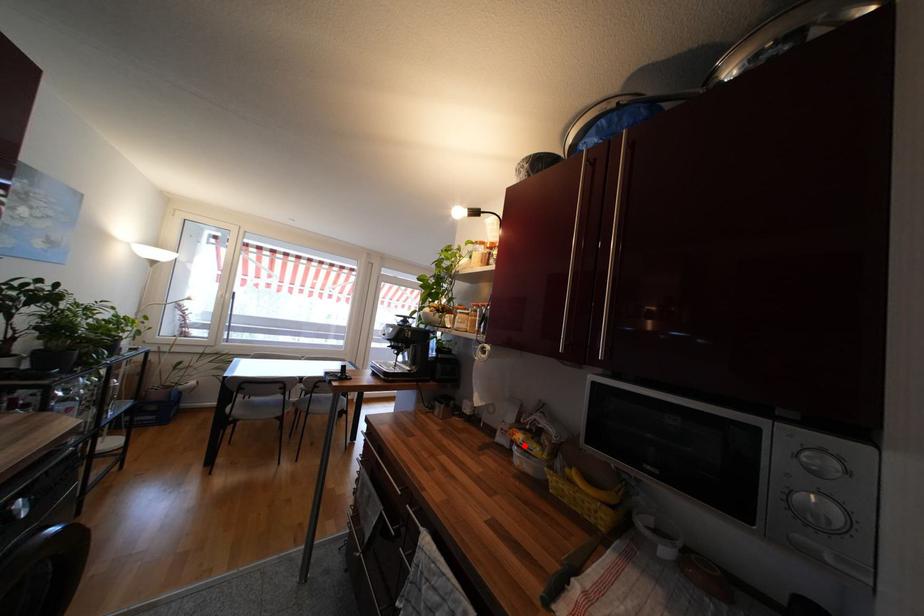
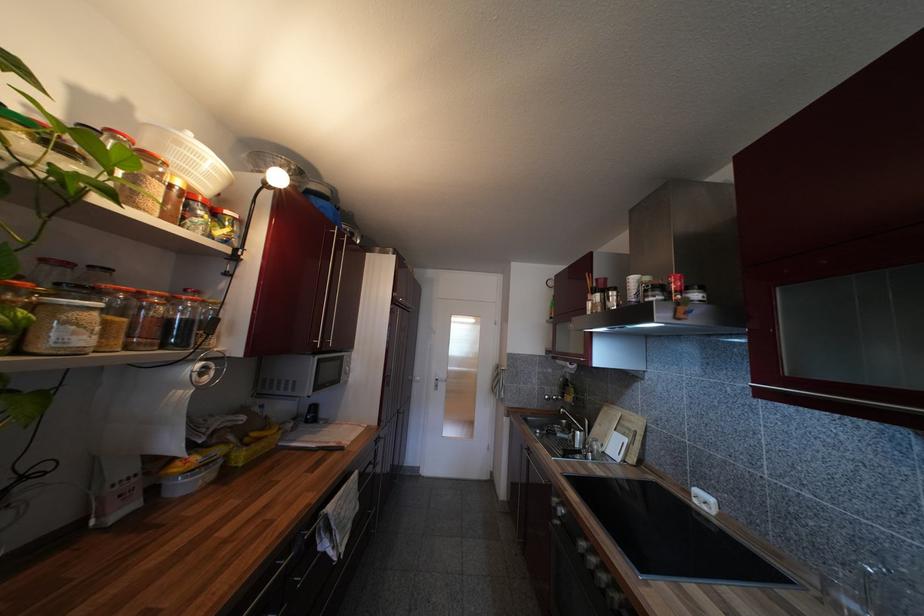
Find the pixel in the second image that matches the highlighted location in the first image.

(204, 464)